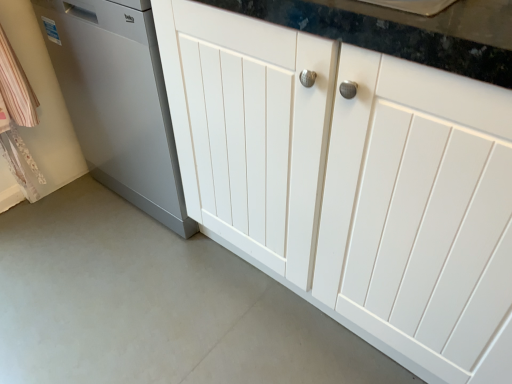
Question: Do you think satin silver dishwasher at left is within white smooth concrete at lower center, or outside of it?

Choices:
 (A) outside
 (B) inside

Answer: (A)

Question: Is satin silver dishwasher at left in front of or behind white smooth concrete at lower center in the image?

Choices:
 (A) behind
 (B) front

Answer: (A)

Question: Which object is the closest to the white smooth concrete at lower center?

Choices:
 (A) satin silver dishwasher at left
 (B) white wood cabinet at center

Answer: (A)

Question: Which is farther from the white wood cabinet at center?

Choices:
 (A) white smooth concrete at lower center
 (B) satin silver dishwasher at left

Answer: (A)